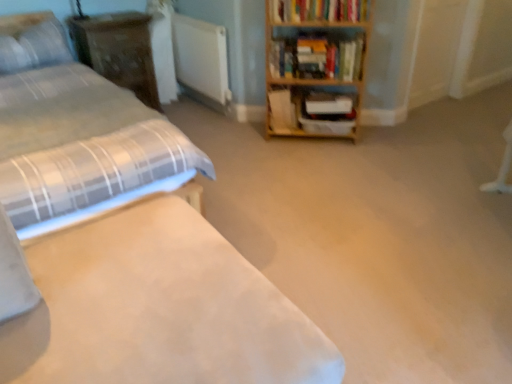
The width and height of the screenshot is (512, 384). I want to click on vacant area that is situated to the right of wooden bookcase at upper right, so click(384, 145).